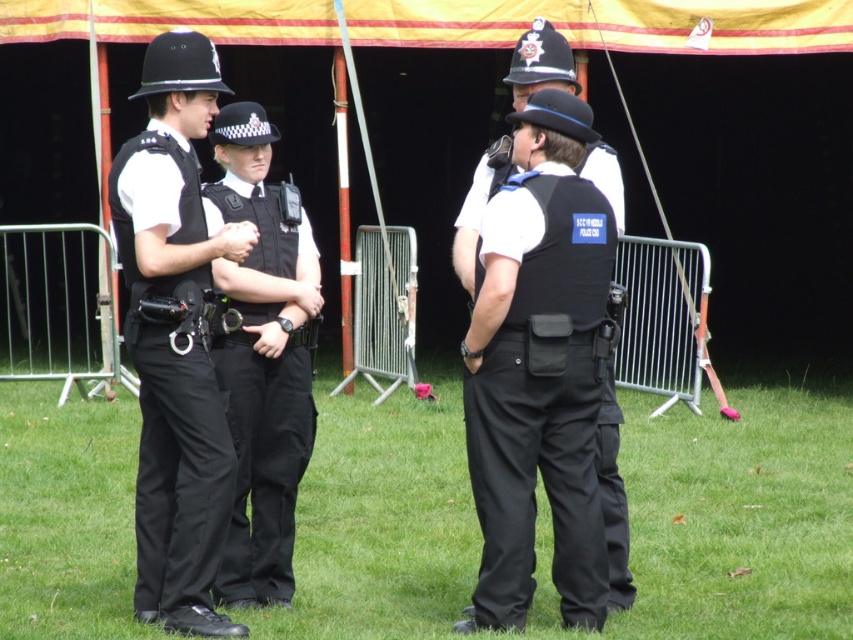
Between yellow fabric tent at center and yellow fabric canopy at upper center, which one has less height?

yellow fabric tent at center is shorter.

Is point (785, 51) positioned behind point (120, 12)?

That is True.

This screenshot has height=640, width=853. Find the location of `yellow fabric tent at center`. yellow fabric tent at center is located at coordinates (612, 22).

Does yellow fabric tent at center have a greater height compared to black uniform at center?

Incorrect, yellow fabric tent at center's height is not larger of black uniform at center's.

Who is positioned more to the left, yellow fabric tent at center or black uniform at center?

Answer: Positioned to the left is yellow fabric tent at center.

This screenshot has height=640, width=853. Describe the element at coordinates (612, 22) in the screenshot. I see `yellow fabric tent at center` at that location.

Identify the location of yellow fabric tent at center. The width and height of the screenshot is (853, 640). (612, 22).

Is green grass at center to the left of yellow fabric tent at center from the viewer's perspective?

In fact, green grass at center is to the right of yellow fabric tent at center.

Which of these two, green grass at center or yellow fabric tent at center, stands taller?

yellow fabric tent at center is taller.

Is point (363, 593) more distant than point (456, 241)?

Yes, point (363, 593) is behind point (456, 241).

Locate an element on the screen. The height and width of the screenshot is (640, 853). green grass at center is located at coordinates (740, 516).